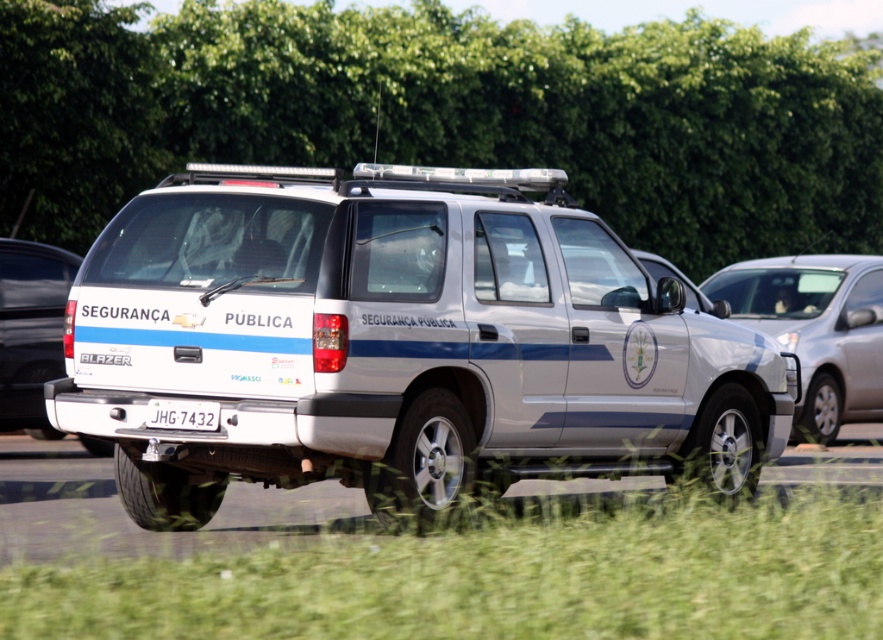
Does point (472, 179) lie behind point (34, 280)?

That is False.

Can you confirm if white metallic police car at center is positioned above white matte suv at left?

Correct, white metallic police car at center is located above white matte suv at left.

Identify the location of white metallic police car at center. This screenshot has height=640, width=883. (400, 342).

Consider the image. Can you confirm if green leafy hedge at upper center is positioned below white plastic license plate at center?

Incorrect, green leafy hedge at upper center is not positioned below white plastic license plate at center.

Which of these two, green leafy hedge at upper center or white plastic license plate at center, stands shorter?

white plastic license plate at center

What do you see at coordinates (447, 115) in the screenshot? I see `green leafy hedge at upper center` at bounding box center [447, 115].

Locate an element on the screen. The width and height of the screenshot is (883, 640). green leafy hedge at upper center is located at coordinates (447, 115).

Is point (472, 362) closer to viewer compared to point (161, 417)?

That is False.

Can you confirm if white metallic police car at center is positioned to the right of white plastic license plate at center?

Yes, white metallic police car at center is to the right of white plastic license plate at center.

Is point (180, 227) farther from viewer compared to point (186, 426)?

Yes, point (180, 227) is behind point (186, 426).

Locate an element on the screen. Image resolution: width=883 pixels, height=640 pixels. white metallic police car at center is located at coordinates (400, 342).